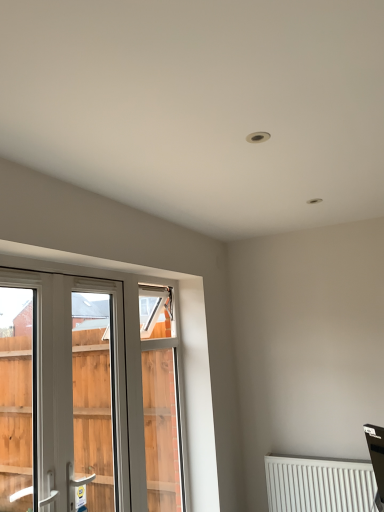
What do you see at coordinates (83, 399) in the screenshot?
I see `white plastic window at left` at bounding box center [83, 399].

Describe the element at coordinates (93, 399) in the screenshot. I see `white plastic screen door at left` at that location.

Identify the location of white plastic window at left. The image size is (384, 512). (83, 399).

Looking at this image, considering the sizes of objects white matte radiator at lower right and white plastic screen door at left in the image provided, who is wider, white matte radiator at lower right or white plastic screen door at left?

white matte radiator at lower right.

Looking at the image, does white matte radiator at lower right seem bigger or smaller compared to white plastic screen door at left?

Clearly, white matte radiator at lower right is smaller in size than white plastic screen door at left.

Does white matte radiator at lower right have a greater height compared to white plastic screen door at left?

In fact, white matte radiator at lower right may be shorter than white plastic screen door at left.

Is white matte radiator at lower right spatially inside white plastic screen door at left, or outside of it?

white matte radiator at lower right exists outside the volume of white plastic screen door at left.

Which is correct: white plastic window at left is inside white matte radiator at lower right, or outside of it?

white plastic window at left lies outside white matte radiator at lower right.

Consider the image. What's the angular difference between white plastic window at left and white matte radiator at lower right's facing directions?

90 degrees.

Does white plastic window at left have a larger size compared to white matte radiator at lower right?

Incorrect, white plastic window at left is not larger than white matte radiator at lower right.

Does point (107, 344) come farther from viewer compared to point (280, 482)?

Yes.

You are a GUI agent. You are given a task and a screenshot of the screen. Output one action in this format:
    pyautogui.click(x=<x>, y=<y>)
    Task: Click on the radiator below the white plastic screen door at left (from the image's perspective)
    The height and width of the screenshot is (512, 384).
    Given the screenshot: What is the action you would take?
    pyautogui.click(x=319, y=485)

Consider the image. Measure the distance from white plastic screen door at left to white matte radiator at lower right.

white plastic screen door at left and white matte radiator at lower right are 1.77 meters apart.

Are white plastic screen door at left and white matte radiator at lower right making contact?

No, white plastic screen door at left is not beside white matte radiator at lower right.

Considering the relative sizes of white plastic window at left and white plastic screen door at left in the image provided, is white plastic window at left wider than white plastic screen door at left?

No.

Consider the image. Does white plastic window at left appear on the right side of white plastic screen door at left?

No.

Is white plastic window at left smaller than white plastic screen door at left?

Indeed, white plastic window at left has a smaller size compared to white plastic screen door at left.

Is white matte radiator at lower right oriented towards white plastic window at left?

No, white matte radiator at lower right is not facing towards white plastic window at left.

Is white matte radiator at lower right to the left of white plastic window at left from the viewer's perspective?

Incorrect, white matte radiator at lower right is not on the left side of white plastic window at left.

From the image's perspective, would you say white matte radiator at lower right is positioned over white plastic window at left?

No, from the image's perspective, white matte radiator at lower right is not on top of white plastic window at left.

Is white plastic window at left a part of white plastic screen door at left?

Indeed, white plastic window at left is located within white plastic screen door at left.

Which of these two, white plastic screen door at left or white plastic window at left, stands shorter?

Standing shorter between the two is white plastic screen door at left.

Is white plastic screen door at left further to camera compared to white plastic window at left?

Yes, white plastic screen door at left is behind white plastic window at left.

Would you say white plastic screen door at left is to the left or to the right of white plastic window at left in the picture?

white plastic screen door at left is positioned on white plastic window at left's right side.

Where is `screen door in front of the white matte radiator at lower right`? The height and width of the screenshot is (512, 384). screen door in front of the white matte radiator at lower right is located at coordinates (93, 399).

Identify the location of radiator lying below the white plastic window at left (from the image's perspective). (319, 485).

Which object lies nearer to the anchor point white plastic window at left, white matte radiator at lower right or white plastic screen door at left?

white matte radiator at lower right.

When comparing their distances from white plastic screen door at left, does white plastic window at left or white matte radiator at lower right seem further?

The object further to white plastic screen door at left is white matte radiator at lower right.

Which object lies further to the anchor point white matte radiator at lower right, white plastic screen door at left or white plastic window at left?

Among the two, white plastic screen door at left is located further to white matte radiator at lower right.

In the scene shown: Which object lies nearer to the anchor point white plastic screen door at left, white matte radiator at lower right or white plastic window at left?

white plastic window at left.

Considering their positions, is white plastic screen door at left positioned closer to white plastic window at left than white matte radiator at lower right?

Based on the image, white matte radiator at lower right appears to be nearer to white plastic window at left.

Estimate the real-world distances between objects in this image. Which object is further from white matte radiator at lower right, white plastic window at left or white plastic screen door at left?

Based on the image, white plastic screen door at left appears to be further to white matte radiator at lower right.

At what (x,y) coordinates should I click in order to perform the action: click on screen door situated between white plastic window at left and white matte radiator at lower right from left to right. Please return your answer as a coordinate pair (x, y). The image size is (384, 512). Looking at the image, I should click on (93, 399).